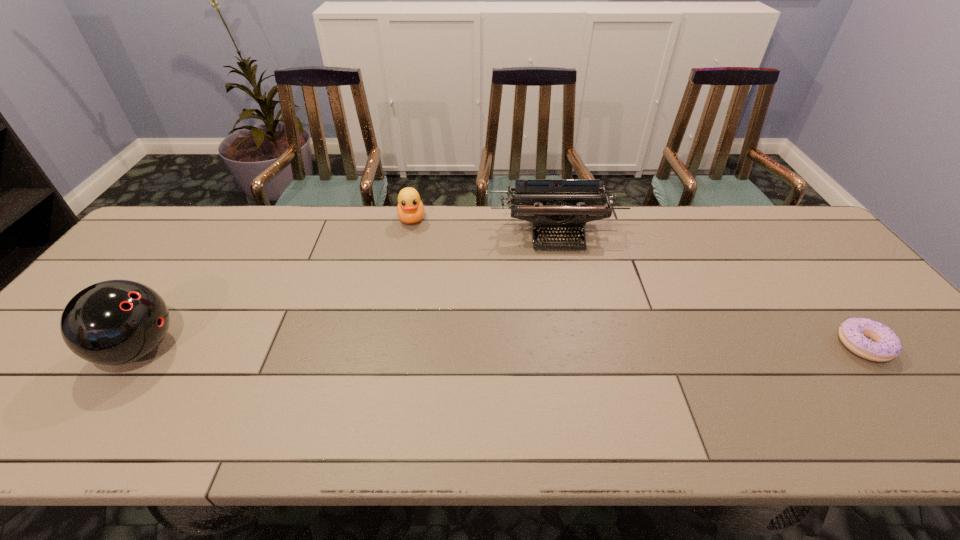
Identify the location of vacant spot on the desktop that is between the bowling ball and the shortest object and is positioned on the face of the duckling. (419, 347).

Find the location of a particular element. free space on the desktop that is between the tallest object and the shortest object and is positioned on the typing side of the typewriter is located at coordinates (576, 347).